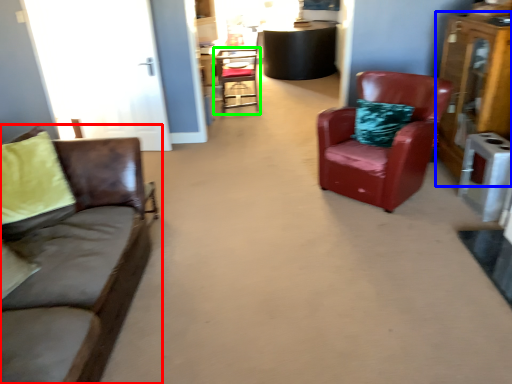
Question: Which object is positioned farthest from studio couch (highlighted by a red box)? Select from dresser (highlighted by a blue box) and chair (highlighted by a green box).

Choices:
 (A) dresser
 (B) chair

Answer: (B)